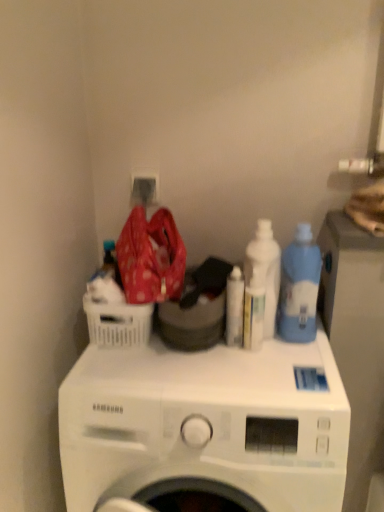
Question: Is white plastic bottle at center positioned behind blue translucent bottle at right, placed as the first cleaning product when sorted from right to left?

Choices:
 (A) no
 (B) yes

Answer: (B)

Question: Considering the relative sizes of white plastic bottle at center and blue translucent bottle at right, placed as the first cleaning product when sorted from right to left, in the image provided, is white plastic bottle at center shorter than blue translucent bottle at right, placed as the first cleaning product when sorted from right to left,?

Choices:
 (A) no
 (B) yes

Answer: (B)

Question: Is white plastic bottle at center turned away from blue translucent bottle at right, placed as the first cleaning product when sorted from right to left?

Choices:
 (A) yes
 (B) no

Answer: (B)

Question: From the image's perspective, does white plastic bottle at center appear higher than blue translucent bottle at right, placed as the third cleaning product when sorted from left to right?

Choices:
 (A) yes
 (B) no

Answer: (B)

Question: Is white plastic bottle at center aimed at blue translucent bottle at right, placed as the first cleaning product when sorted from right to left?

Choices:
 (A) no
 (B) yes

Answer: (A)

Question: Is white plastic bottle at center not close to blue translucent bottle at right, placed as the third cleaning product when sorted from left to right?

Choices:
 (A) no
 (B) yes

Answer: (A)

Question: Is blue translucent bottle at right, placed as the third cleaning product when sorted from left to right, thinner than white plastic basket at left?

Choices:
 (A) yes
 (B) no

Answer: (B)

Question: Considering the relative sizes of blue translucent bottle at right, placed as the third cleaning product when sorted from left to right, and white plastic basket at left in the image provided, is blue translucent bottle at right, placed as the third cleaning product when sorted from left to right, smaller than white plastic basket at left?

Choices:
 (A) no
 (B) yes

Answer: (A)

Question: Is white plastic basket at left a part of blue translucent bottle at right, placed as the third cleaning product when sorted from left to right?

Choices:
 (A) yes
 (B) no

Answer: (B)

Question: Can you confirm if blue translucent bottle at right, placed as the first cleaning product when sorted from right to left, is bigger than white plastic basket at left?

Choices:
 (A) yes
 (B) no

Answer: (A)

Question: Is blue translucent bottle at right, placed as the third cleaning product when sorted from left to right, in front of white plastic basket at left?

Choices:
 (A) no
 (B) yes

Answer: (A)

Question: Is the position of blue translucent bottle at right, placed as the third cleaning product when sorted from left to right, more distant than that of white plastic basket at left?

Choices:
 (A) yes
 (B) no

Answer: (A)

Question: From a real-world perspective, is blue translucent bottle at right, placed as the third cleaning product when sorted from left to right, physically below white matte washing machine at center?

Choices:
 (A) no
 (B) yes

Answer: (A)